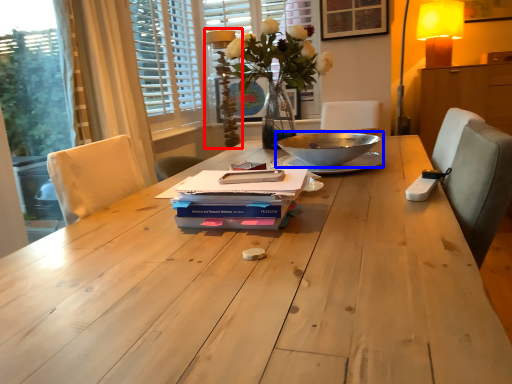
Question: Among these objects, which one is nearest to the camera, table lamp (highlighted by a red box) or bowl (highlighted by a blue box)?

Choices:
 (A) table lamp
 (B) bowl

Answer: (B)